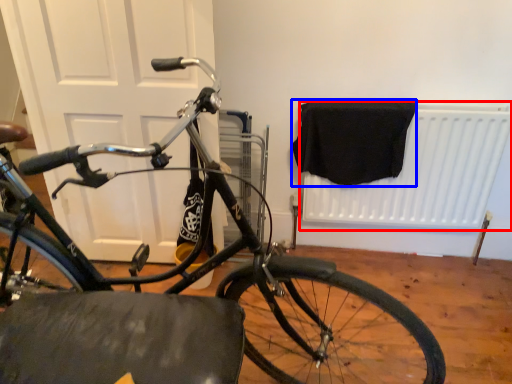
Question: Which of the following is the closest to the observer, radiator (highlighted by a red box) or blanket (highlighted by a blue box)?

Choices:
 (A) radiator
 (B) blanket

Answer: (B)